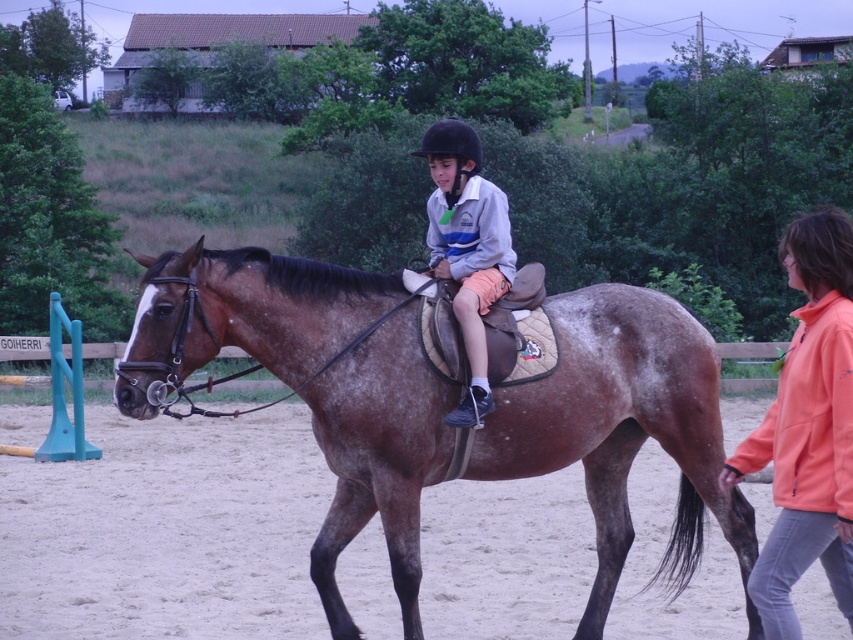
Consider the image. You are organizing a horse riding event and need to ensure that the brown speckled saddle at center and the orange fleece jacket at right are displayed in a booth. The booth has a limited space where the saddle must be placed in a smaller area than the jacket. Does the current arrangement of the saddle and jacket in the image meet this requirement?

The brown speckled saddle at center occupies less space than the orange fleece jacket at right, so the current arrangement meets the requirement as the saddle is placed in a smaller area than the jacket.

You are a drone operator trying to capture a photo of the brown speckled saddle at center. The camera is currently positioned at the origin point. What are the coordinates you need to adjust to center the saddle in the frame?

The coordinates to adjust are 0.669 on the x axis and 0.730 on the y axis to center the brown speckled saddle at center in the frame.

You are a rider in the arena and want to move from your current position to the jump obstacle on the left. There are two points marked in the arena. One is at point (631, 416) and the other is at point (494, 250). Which point should you go to first to reach the jump obstacle on the left?

Point (631, 416) is in front of point (494, 250), so you should go to point (494, 250) first to reach the jump obstacle on the left.